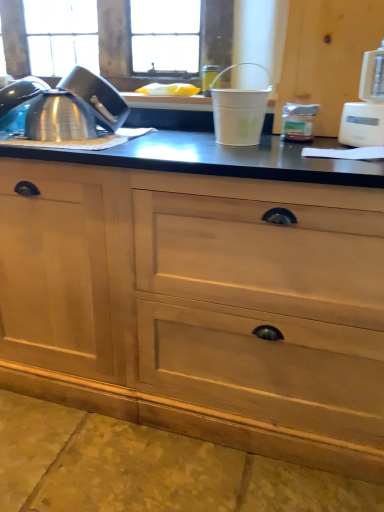
Question: Would you say satin metallic teapot at left is inside or outside white plastic bucket at center, which is the 2th appliance from right to left?

Choices:
 (A) outside
 (B) inside

Answer: (A)

Question: Does point (59, 102) appear closer or farther from the camera than point (251, 100)?

Choices:
 (A) farther
 (B) closer

Answer: (A)

Question: Which object is positioned closest to the white plastic bucket at center, which is the 2th appliance from right to left?

Choices:
 (A) natural wood cabinet at center, the second cabinetry positioned from the right
 (B) wooden cabinet at right, positioned as the first cabinetry in right-to-left order
 (C) satin metallic teapot at left
 (D) white plastic blender at right, placed as the 2th appliance when sorted from left to right

Answer: (D)

Question: Which object is the farthest from the natural wood cabinet at center, placed as the first cabinetry when sorted from left to right?

Choices:
 (A) white plastic blender at right, placed as the 2th appliance when sorted from left to right
 (B) white plastic bucket at center, which is the 2th appliance from right to left
 (C) satin metallic teapot at left
 (D) wooden cabinet at right, positioned as the first cabinetry in right-to-left order

Answer: (D)